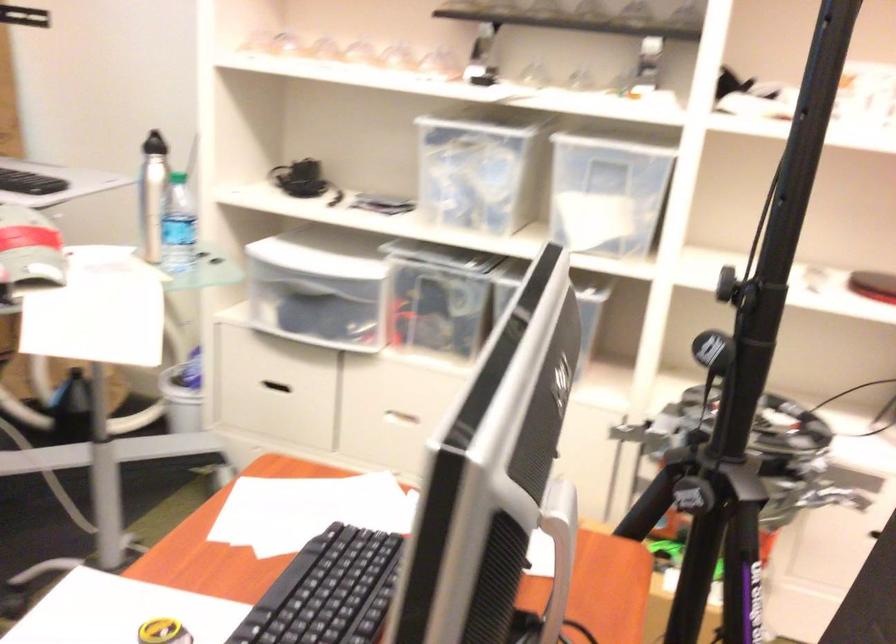
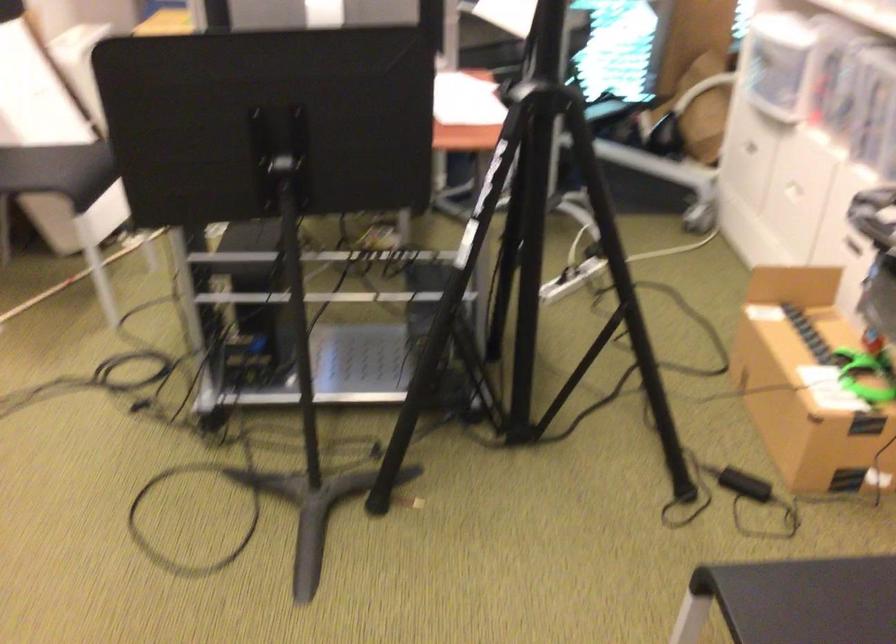
Question: I am providing you with two images of the same scene from different viewpoints. Which of the following objects are not visible in image2?

Choices:
 (A) yellow rolling cart
 (B) chair sitting surface
 (C) cardboard box
 (D) yellow tape roll

Answer: (D)